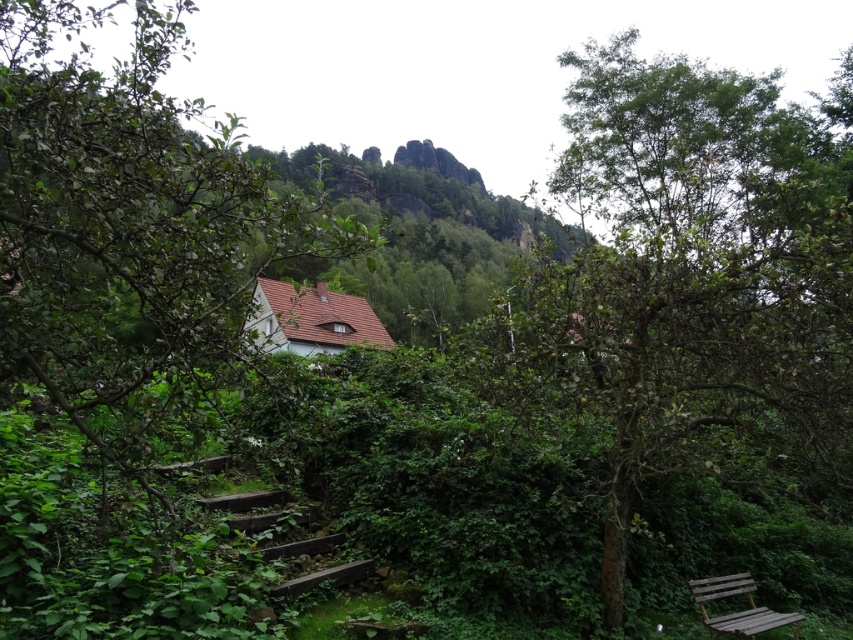
Question: Is green leafy tree at center above green leafy tree at left?

Choices:
 (A) no
 (B) yes

Answer: (A)

Question: Considering the real-world distances, which object is farthest from the wooden bench at lower right?

Choices:
 (A) green leafy tree at center
 (B) green leafy tree at left

Answer: (B)

Question: Observing the image, what is the correct spatial positioning of green leafy tree at center in reference to wooden bench at lower right?

Choices:
 (A) left
 (B) right

Answer: (B)

Question: Does green leafy tree at center appear on the right side of green leafy tree at left?

Choices:
 (A) yes
 (B) no

Answer: (A)

Question: Which of these objects is positioned farthest from the green leafy tree at left?

Choices:
 (A) green leafy tree at center
 (B) wooden bench at lower right

Answer: (A)

Question: Which point appears farthest from the camera in this image?

Choices:
 (A) (154, 241)
 (B) (779, 625)
 (C) (776, 298)

Answer: (B)